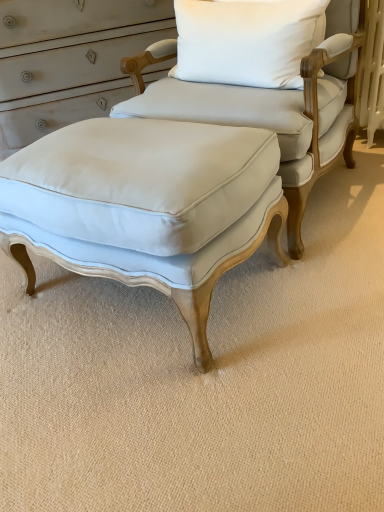
Question: Considering their positions, is white cotton pillow at upper center located in front of or behind light blue fabric ottoman at center?

Choices:
 (A) behind
 (B) front

Answer: (A)

Question: Is point (220, 80) closer or farther from the camera than point (327, 69)?

Choices:
 (A) closer
 (B) farther

Answer: (A)

Question: Which object is the closest to the matte white fabric stool at center?

Choices:
 (A) light blue fabric ottoman at center
 (B) white cotton pillow at upper center

Answer: (A)

Question: Which is nearer to the matte white fabric stool at center?

Choices:
 (A) white cotton pillow at upper center
 (B) light blue fabric ottoman at center

Answer: (B)